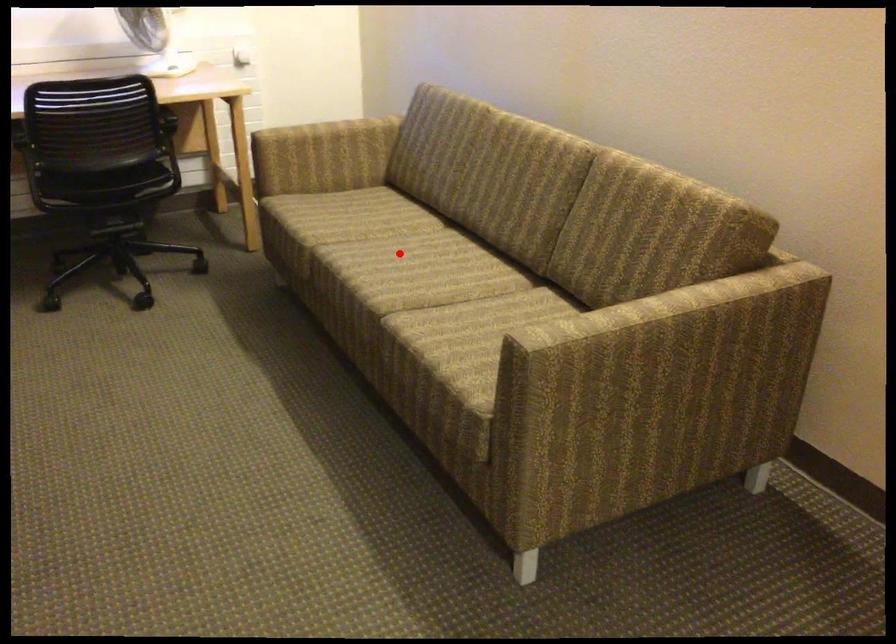
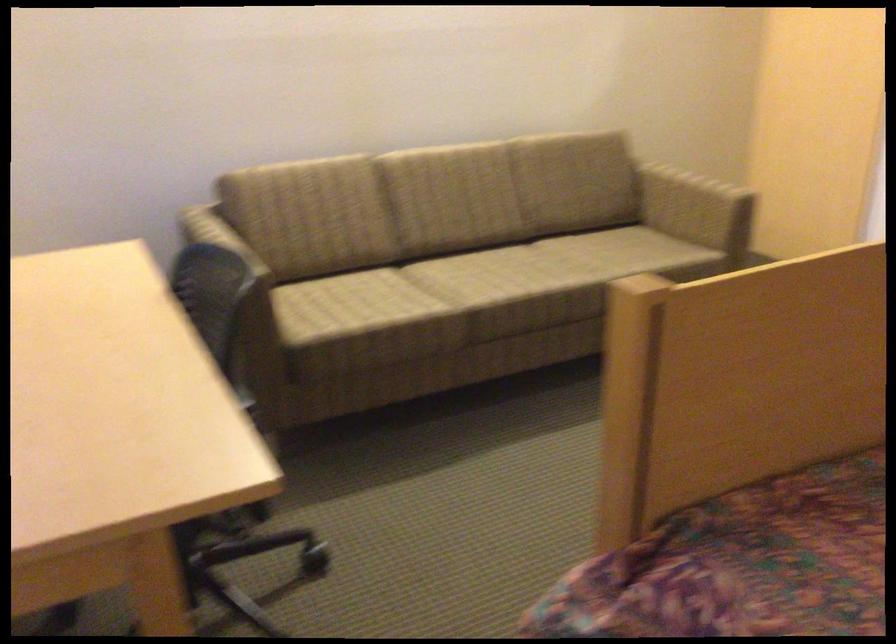
Question: I am providing you with two images of the same scene from different viewpoints. Image1 has a red point marked. In image2, the corresponding 3D location appears at what relative position? Reply with the corresponding letter.

Choices:
 (A) Closer
 (B) Farther

Answer: (B)